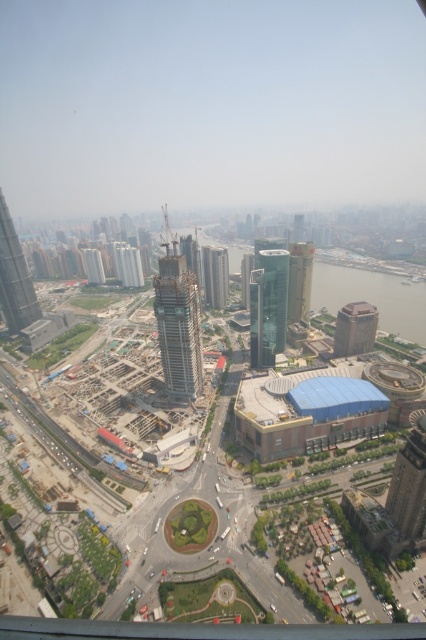
You are a drone operator trying to navigate between two points in the urban landscape. The first point is at coordinates point (298, 296) and the second is at point (86, 253). Based on the scene, which point is closer to the observer?

Point (298, 296) is in front of point (86, 253), so it is closer to the observer.

You are standing at the center of the city and see the point marked as point (299, 282). What does this point represent in the urban landscape?

The point (299, 282) represents the glassy green skyscraper at right.

Based on the scene description, can you identify the object located at the coordinates point [267,305]?

The point [267,305] indicates the green glass tower at center.